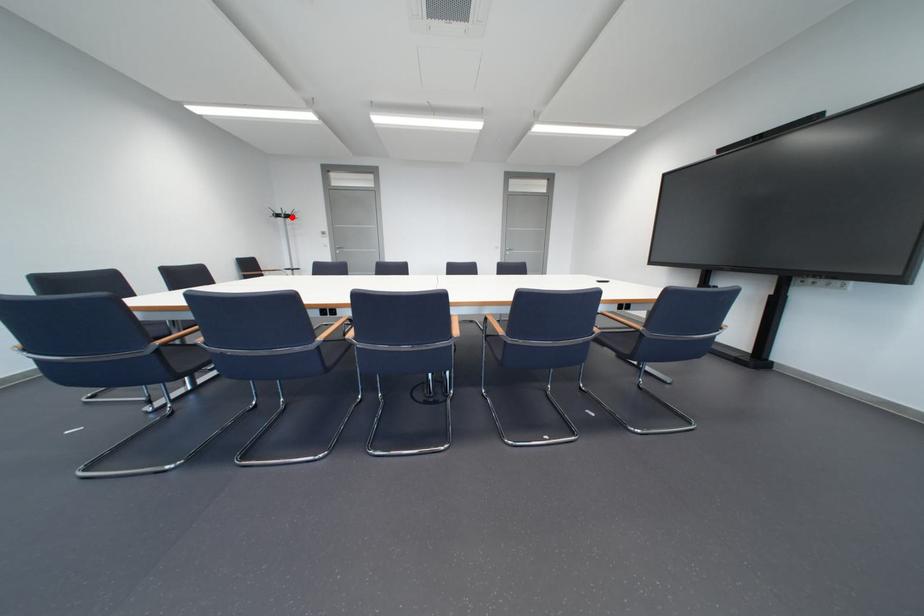
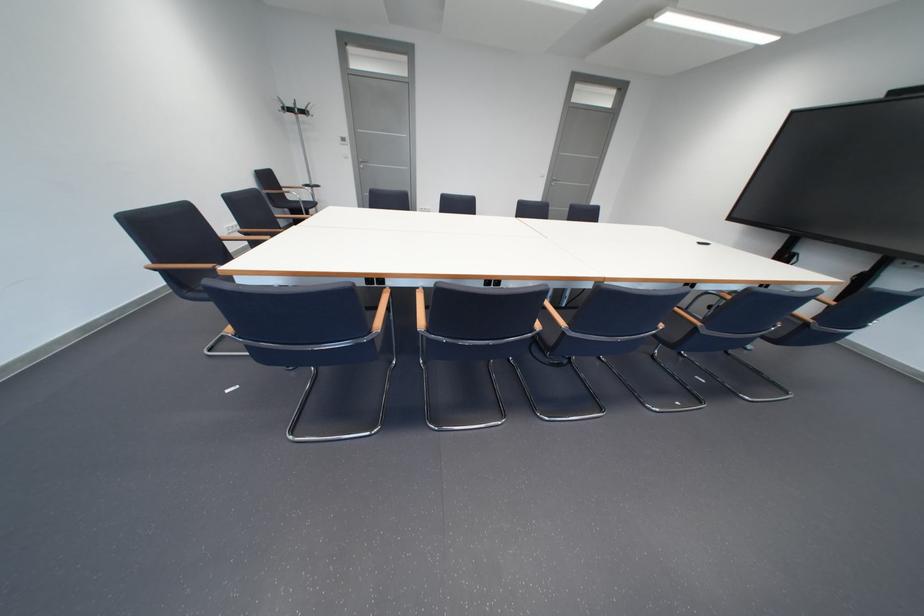
Where in the second image is the point corresponding to the highlighted location from the first image?

(304, 111)